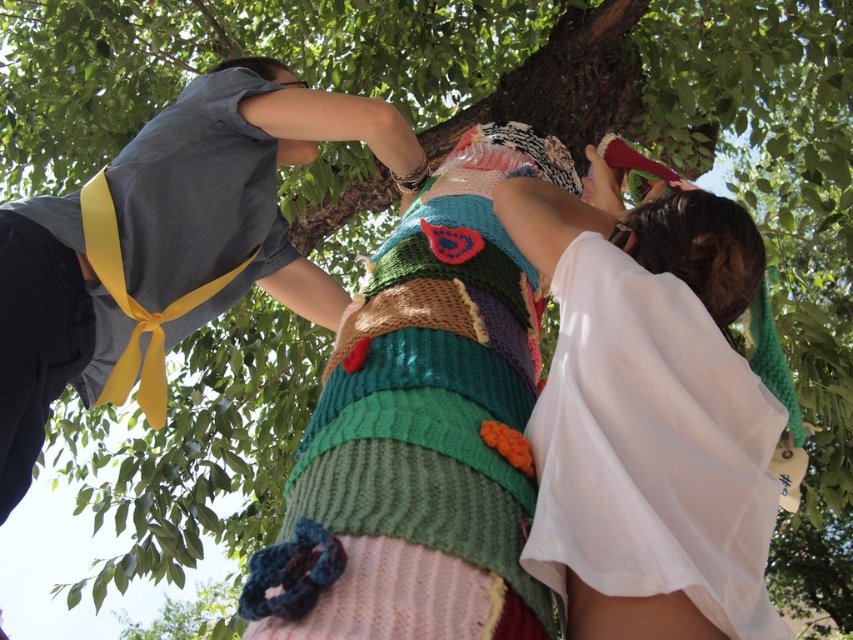
You are standing in the park and see two items in the image. The first is the knitted fabric at center and the second is the white sheer fabric dress at lower right. Which item is positioned closer to the left side of the scene?

The knitted fabric at center is positioned to the left of the white sheer fabric dress at lower right, so it is closer to the left side of the scene.